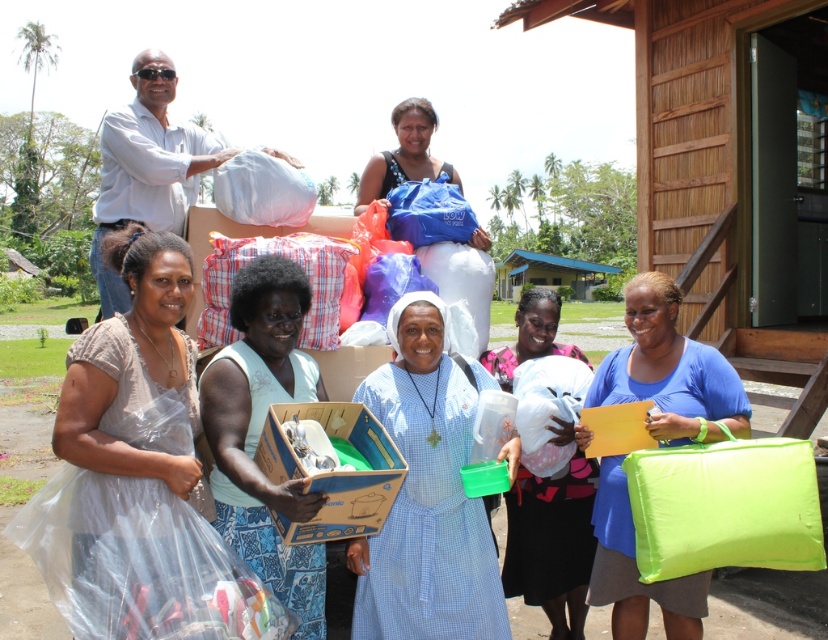
Can you confirm if light blue fabric at center is thinner than white matte shirt at upper left?

Incorrect, light blue fabric at center's width is not less than white matte shirt at upper left's.

Does point (289, 323) come farther from viewer compared to point (124, 192)?

No, it is not.

Describe the element at coordinates (258, 433) in the screenshot. I see `light blue fabric at center` at that location.

At what (x,y) coordinates should I click in order to perform the action: click on light blue fabric at center. Please return your answer as a coordinate pair (x, y). This screenshot has width=828, height=640. Looking at the image, I should click on (258, 433).

Does point (593, 385) come behind point (282, 156)?

That is False.

Can you confirm if neon green fabric pillow at lower right is taller than white matte shirt at upper left?

Indeed, neon green fabric pillow at lower right has a greater height compared to white matte shirt at upper left.

Which is behind, point (629, 305) or point (167, 92)?

Point (167, 92)

You are a GUI agent. You are given a task and a screenshot of the screen. Output one action in this format:
    pyautogui.click(x=<x>, y=<y>)
    Task: Click on the neon green fabric pillow at lower right
    Image resolution: width=828 pixels, height=640 pixels.
    Given the screenshot: What is the action you would take?
    pyautogui.click(x=670, y=371)

Does light blue fabric at center have a smaller size compared to blue fabric bag at center?

Yes, light blue fabric at center is smaller than blue fabric bag at center.

What do you see at coordinates (258, 433) in the screenshot? This screenshot has width=828, height=640. I see `light blue fabric at center` at bounding box center [258, 433].

The height and width of the screenshot is (640, 828). I want to click on light blue fabric at center, so click(x=258, y=433).

Identify the location of light blue fabric at center. Image resolution: width=828 pixels, height=640 pixels. (258, 433).